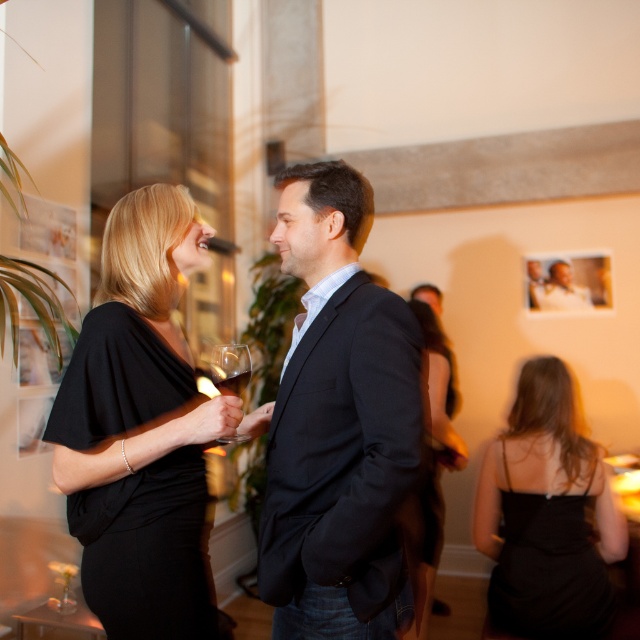
Question: Which object is farther from the camera taking this photo?

Choices:
 (A) black satin dress at left
 (B) translucent glass wine at center

Answer: (B)

Question: Which object is the farthest from the transparent glass at center?

Choices:
 (A) black satin dress at lower right
 (B) black satin dress at center

Answer: (A)

Question: Does black matte suit at center have a lesser width compared to black satin dress at center?

Choices:
 (A) no
 (B) yes

Answer: (B)

Question: Which object appears farthest from the camera in this image?

Choices:
 (A) black satin dress at left
 (B) black matte suit at center
 (C) transparent glass at center
 (D) black satin dress at lower right

Answer: (D)

Question: Can you confirm if black matte suit at center is positioned above transparent glass at center?

Choices:
 (A) no
 (B) yes

Answer: (B)

Question: Does black matte suit at center have a smaller size compared to transparent glass at center?

Choices:
 (A) no
 (B) yes

Answer: (A)